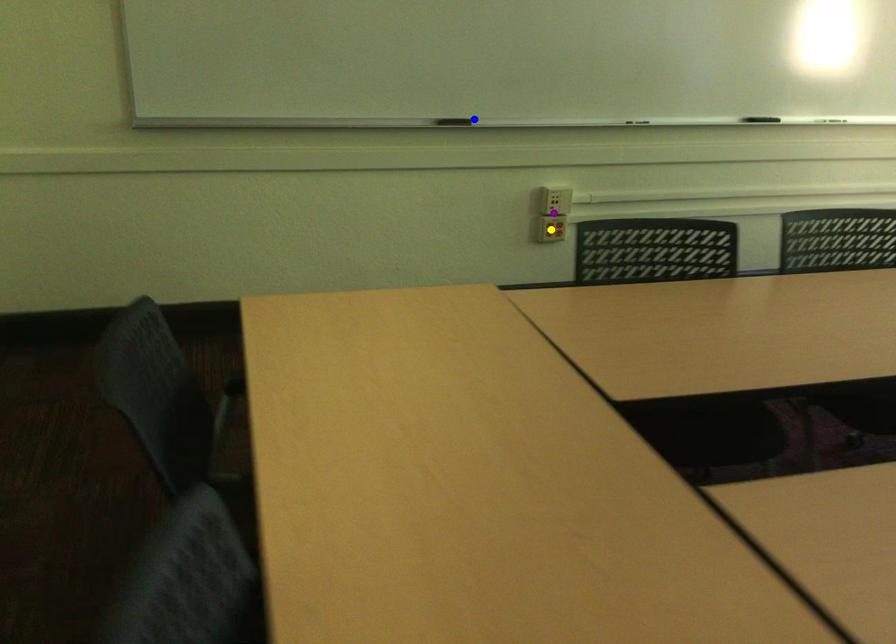
Order these from nearest to farthest:
blue point
purple point
yellow point

blue point
yellow point
purple point